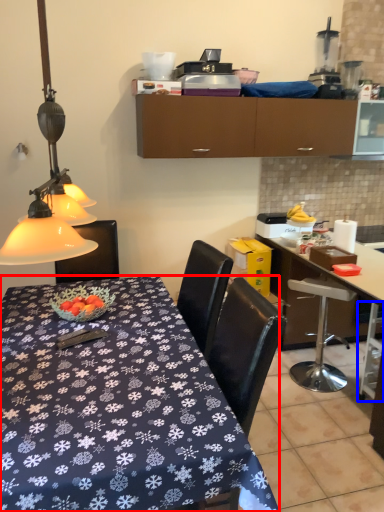
Question: Among these objects, which one is farthest to the camera, desk (highlighted by a red box) or bar stool (highlighted by a blue box)?

Choices:
 (A) desk
 (B) bar stool

Answer: (B)